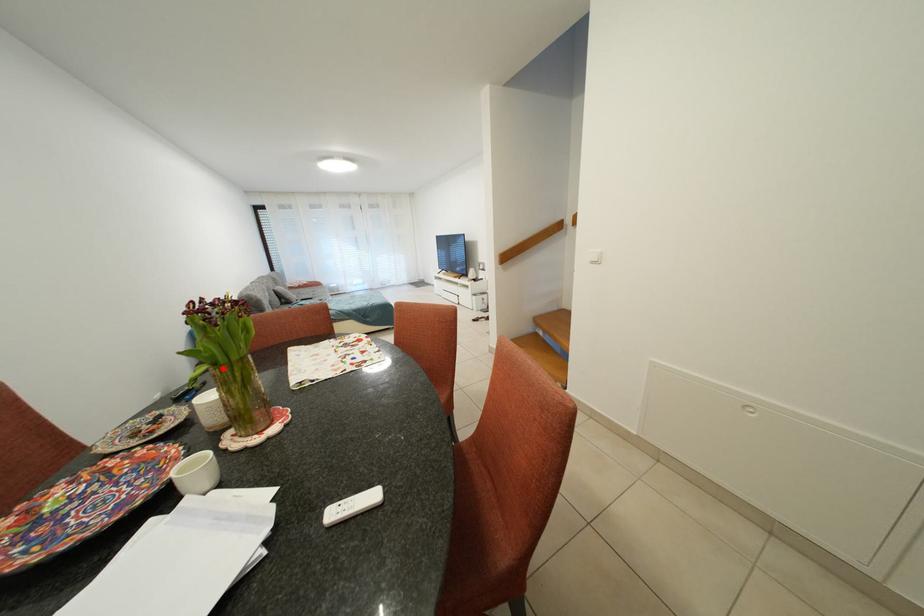
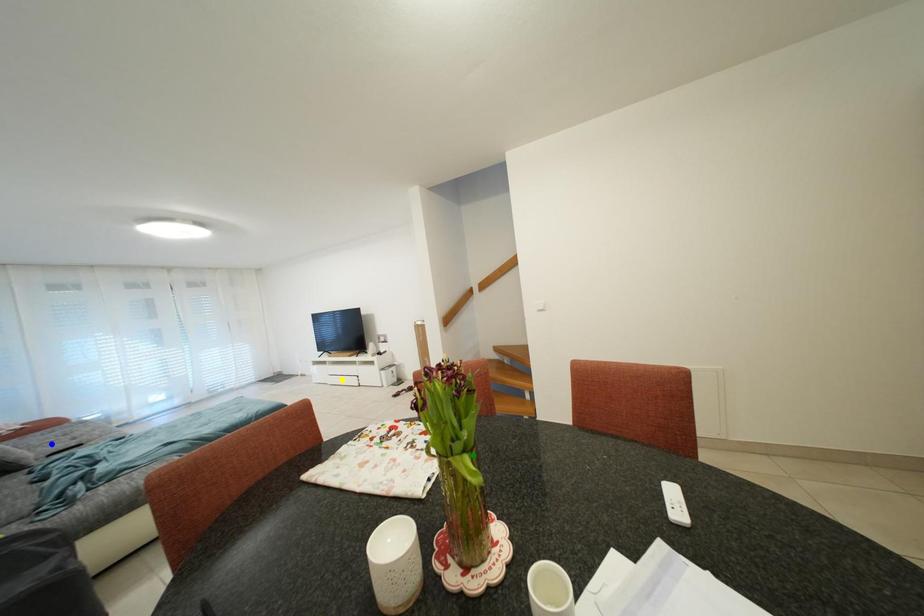
Question: I am providing you with two images of the same scene from different viewpoints. A red point is marked on the first image. You are given multiple points on the second image. Which point in image 2 is actually the same real-world point as the red point in image 1?

Choices:
 (A) yellow point
 (B) blue point
 (C) green point

Answer: (C)